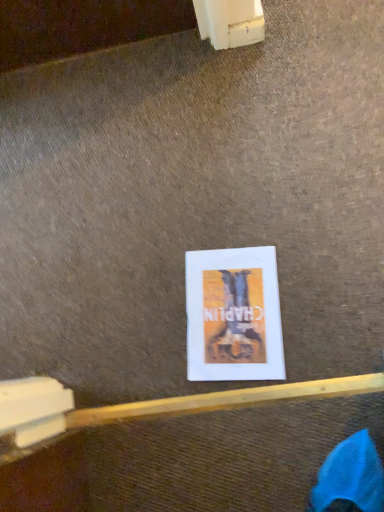
At what (x,y) coordinates should I click in order to perform the action: click on vacant area in front of white paper at center. Please return your answer as a coordinate pair (x, y). The height and width of the screenshot is (512, 384). Looking at the image, I should click on (312, 354).